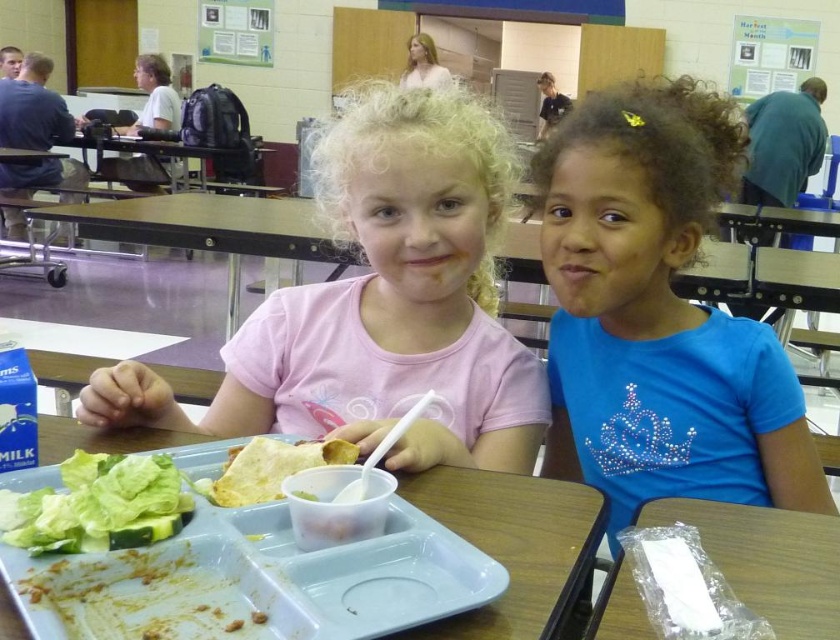
Which is more to the right, matte pink shirt at center or green leafy lettuce at lower left?

Positioned to the right is matte pink shirt at center.

Is point (287, 369) positioned in front of point (38, 545)?

No.

At what (x,y) coordinates should I click in order to perform the action: click on matte pink shirt at center. Please return your answer as a coordinate pair (x, y). Image resolution: width=840 pixels, height=640 pixels. Looking at the image, I should click on (381, 305).

Find the location of `clear plastic bag at lower right`. clear plastic bag at lower right is located at coordinates (768, 560).

Which is behind, point (718, 524) or point (276, 452)?

Positioned behind is point (276, 452).

Identify the location of clear plastic bag at lower right. The width and height of the screenshot is (840, 640). (768, 560).

Which is in front, point (169, 442) or point (790, 532)?

Point (790, 532) is more forward.

Is white plastic tray at center shorter than clear plastic bag at lower right?

In fact, white plastic tray at center may be taller than clear plastic bag at lower right.

Who is more distant from viewer, (518,566) or (748,532)?

The point (748,532) is behind.

Where is `white plastic tray at center`? The image size is (840, 640). white plastic tray at center is located at coordinates (515, 548).